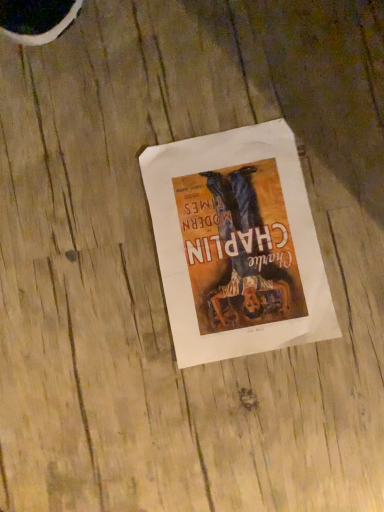
Locate an element on the screen. This screenshot has height=512, width=384. vacant point above matte paper poster at center (from a real-world perspective) is located at coordinates tap(235, 248).